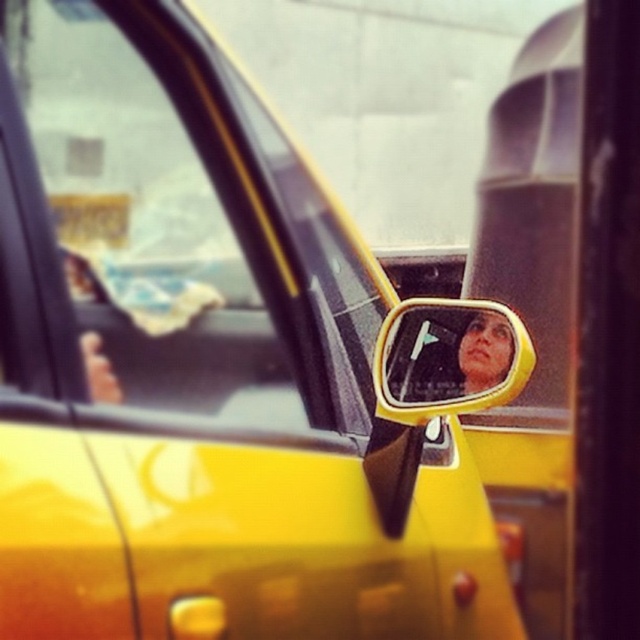
You are a passenger in a yellow taxi and want to check the weather outside. You notice the transparent glass car window at upper left and the yellow plastic mirror at center. Which object should you look through to see the outside environment more clearly?

The transparent glass car window at upper left should be used to see the outside environment more clearly since it is designed for viewing, while the yellow plastic mirror at center reflects images rather than providing a direct view.

You are a passenger in a yellow taxi and want to check the weather outside using your phone. You decide to hold your phone up to either the transparent glass car window at upper left or the yellow plastic mirror at center. Which object will allow you to see the outside environment more clearly?

The transparent glass car window at upper left is closer to the viewer than the yellow plastic mirror at center, so holding the phone up to the transparent glass car window at upper left will allow you to see the outside environment more clearly.

You are a passenger in a yellow taxi and want to touch the point at coordinates (145,218). Is this point located on the car window or the side mirror? Please answer based on the scene description.

The point at coordinates (145,218) is on the transparent glass car window at upper left, so it is located on the car window.